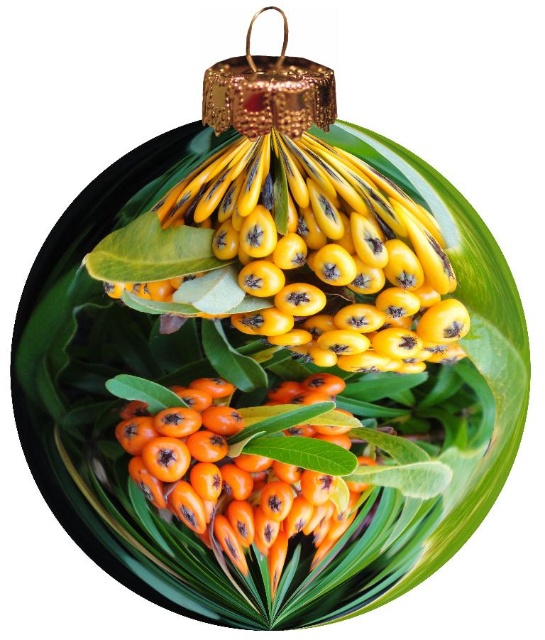
Find the location of a particular element. The width and height of the screenshot is (545, 640). shiny yellow berries at center is located at coordinates (314, 257).

Can you confirm if shiny yellow berries at center is positioned to the right of orange matte berries at center?

Correct, you'll find shiny yellow berries at center to the right of orange matte berries at center.

Locate an element on the screen. shiny yellow berries at center is located at coordinates (314, 257).